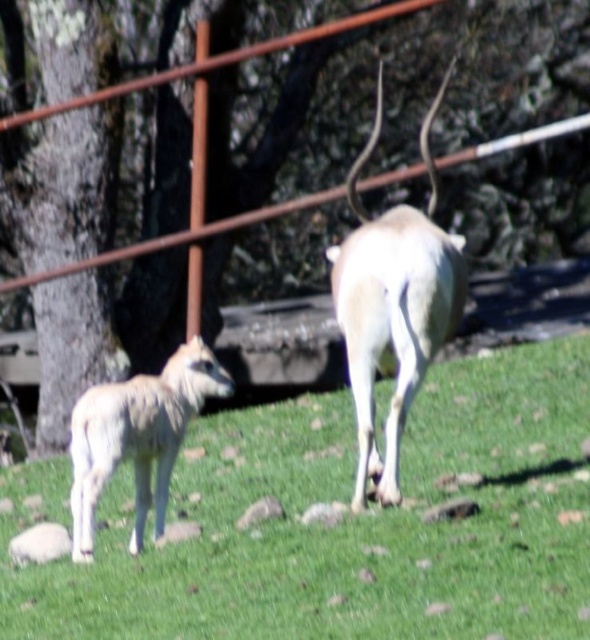
Is point (186, 387) behind point (419, 1)?

No.

Where is `white woolen lamb at lower left`? white woolen lamb at lower left is located at coordinates (137, 436).

This screenshot has width=590, height=640. I want to click on white smooth horned deer at center, so click(394, 305).

Is point (368, 381) positioned behind point (55, 433)?

No, (368, 381) is in front of (55, 433).

You are a GUI agent. You are given a task and a screenshot of the screen. Output one action in this format:
    pyautogui.click(x=<x>, y=<y>)
    Task: Click on the white smooth horned deer at center
    
    Given the screenshot: What is the action you would take?
    pyautogui.click(x=394, y=305)

Who is higher up, green grass at center or white woolen lamb at lower left?

Positioned higher is white woolen lamb at lower left.

What do you see at coordinates (340, 522) in the screenshot? This screenshot has height=640, width=590. I see `green grass at center` at bounding box center [340, 522].

Locate an element on the screen. Image resolution: width=590 pixels, height=640 pixels. green grass at center is located at coordinates (340, 522).